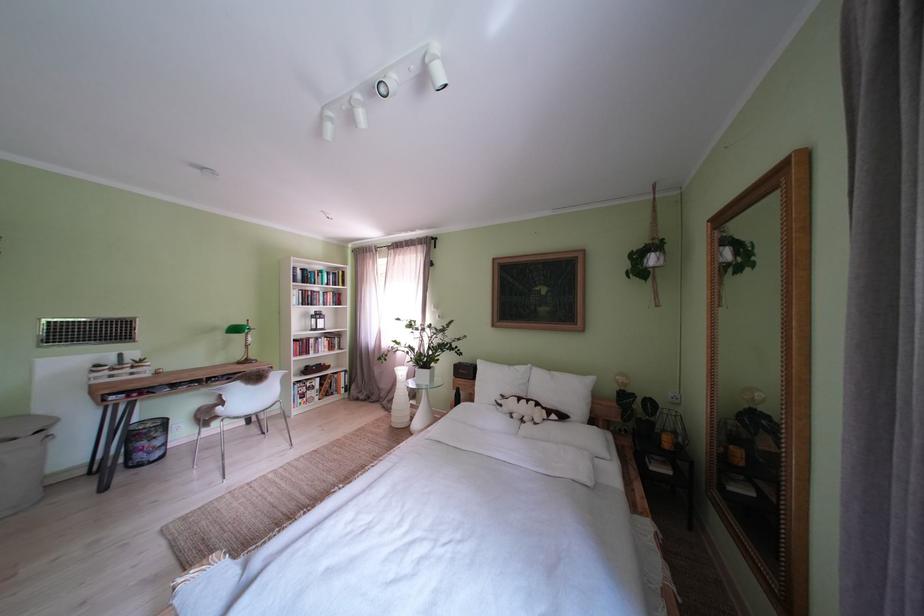
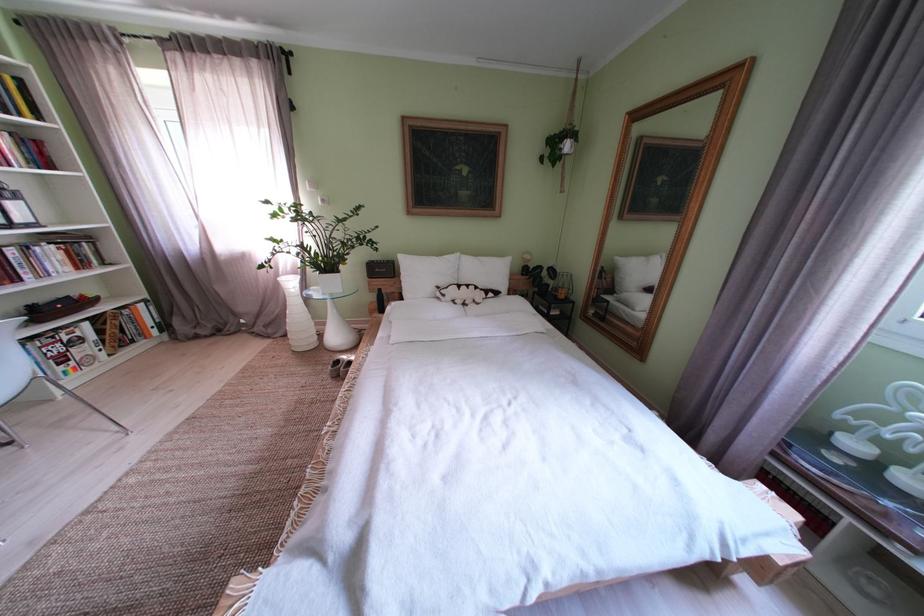
In the second image, find the point that corresponds to point (500, 386) in the first image.

(429, 280)